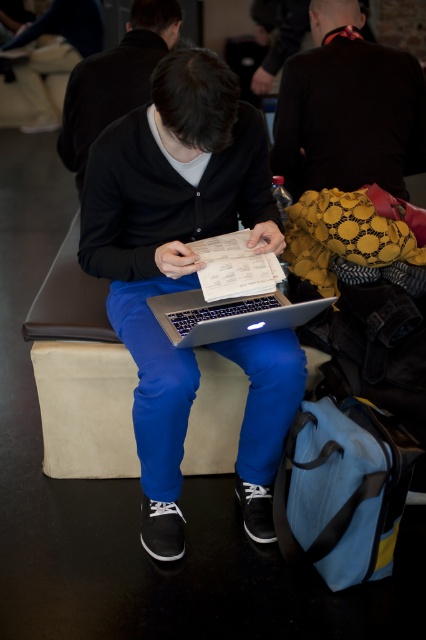
This screenshot has height=640, width=426. Describe the element at coordinates (170, 244) in the screenshot. I see `matte black laptop at center` at that location.

From the picture: Which is above, matte black laptop at center or sleek silver laptop at center?

Positioned higher is matte black laptop at center.

Is point (172, 154) in front of point (158, 301)?

Yes, point (172, 154) is closer to viewer.

Locate an element on the screen. matte black laptop at center is located at coordinates (170, 244).

Between point (186, 380) and point (115, 52), which one is positioned behind?

The point (115, 52) is more distant.

Does point (144, 244) come in front of point (101, 125)?

Yes, point (144, 244) is in front of point (101, 125).

In order to click on matte black laptop at center in this screenshot , I will do `click(170, 244)`.

Which is below, matte black hoodie at center or sleek silver laptop at center?

Positioned lower is sleek silver laptop at center.

Is point (108, 60) farther from viewer compared to point (189, 330)?

Yes, point (108, 60) is behind point (189, 330).

The image size is (426, 640). Describe the element at coordinates (115, 80) in the screenshot. I see `matte black hoodie at center` at that location.

You are a GUI agent. You are given a task and a screenshot of the screen. Output one action in this format:
    pyautogui.click(x=<x>, y=<y>)
    Task: Click on the matte black hoodie at center
    
    Given the screenshot: What is the action you would take?
    pyautogui.click(x=115, y=80)